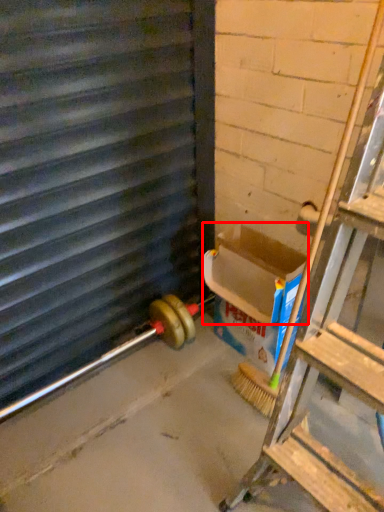
Question: Considering the relative positions of box (annotated by the red box) and window frame in the image provided, where is box (annotated by the red box) located with respect to the staircase?

Choices:
 (A) left
 (B) right

Answer: (B)